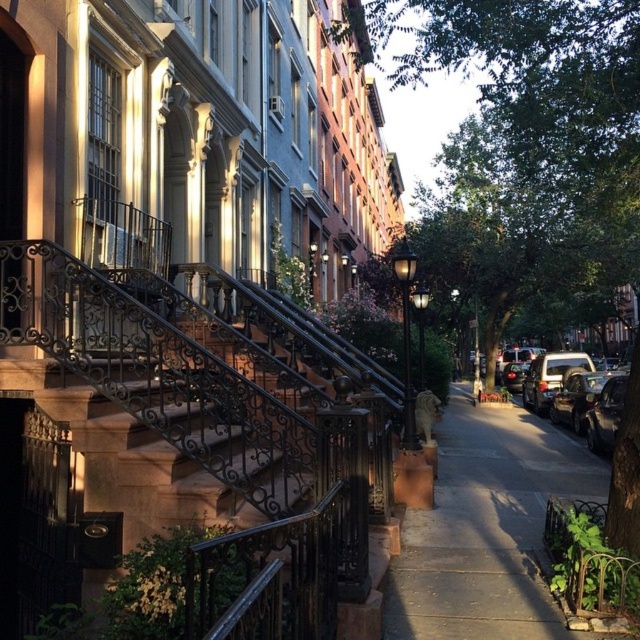
Question: Can you confirm if brown concrete sidewalk at center is positioned to the right of green leafy tree at center?

Choices:
 (A) no
 (B) yes

Answer: (A)

Question: Is green leafy tree at center to the right of shiny black car at right from the viewer's perspective?

Choices:
 (A) yes
 (B) no

Answer: (B)

Question: Can you confirm if brown concrete sidewalk at center is smaller than shiny black car at right?

Choices:
 (A) yes
 (B) no

Answer: (A)

Question: Which of the following is the closest to the observer?

Choices:
 (A) (445, 58)
 (B) (540, 397)
 (C) (554, 364)
 (D) (323, 568)

Answer: (D)

Question: Estimate the real-world distances between objects in this image. Which object is farther from the green leafy tree at center?

Choices:
 (A) black wrought iron balustrade at center
 (B) shiny black car at right
 (C) brown concrete sidewalk at center
 (D) metallic silver suv at right

Answer: (D)

Question: Based on their relative distances, which object is nearer to the black wrought iron balustrade at center?

Choices:
 (A) metallic silver suv at right
 (B) shiny black car at right
 (C) green leafy tree at center
 (D) brown concrete sidewalk at center

Answer: (D)